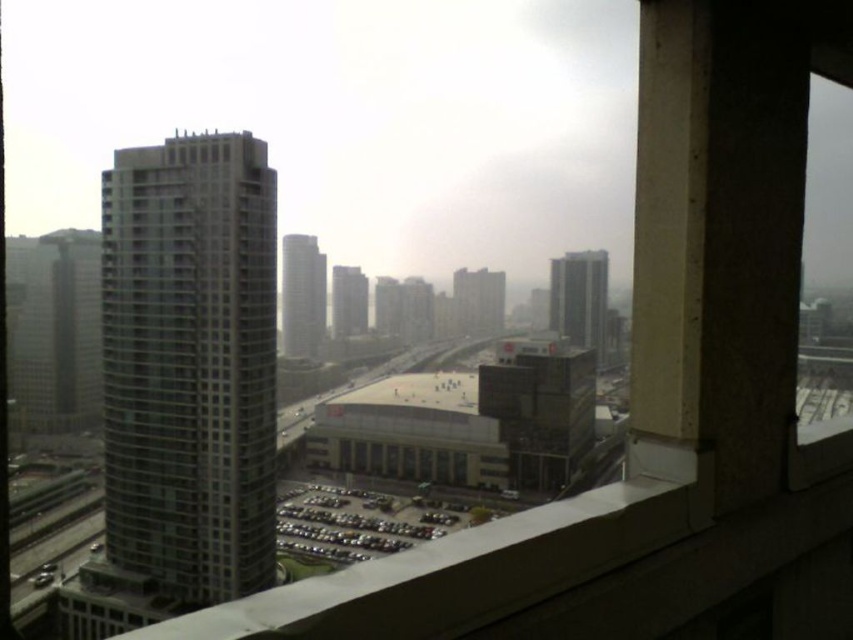
Can you confirm if glassy gray tower at left is positioned to the right of gray glass skyscraper at center?

Indeed, glassy gray tower at left is positioned on the right side of gray glass skyscraper at center.

Does glassy gray tower at left appear under gray glass skyscraper at center?

Yes, glassy gray tower at left is below gray glass skyscraper at center.

The image size is (853, 640). Identify the location of glassy gray tower at left. (190, 364).

Where is `glassy gray tower at left`? Image resolution: width=853 pixels, height=640 pixels. glassy gray tower at left is located at coordinates (190, 364).

Consider the image. Is glassy reflective building at center closer to the viewer compared to glassy reflective skyscraper at center?

Yes, glassy reflective building at center is in front of glassy reflective skyscraper at center.

You are a GUI agent. You are given a task and a screenshot of the screen. Output one action in this format:
    pyautogui.click(x=<x>, y=<y>)
    Task: Click on the glassy reflective building at center
    This screenshot has height=640, width=853.
    Given the screenshot: What is the action you would take?
    pyautogui.click(x=579, y=298)

What are the coordinates of `glassy reflective building at center` in the screenshot? It's located at (579, 298).

Can you confirm if glassy gray tower at left is thinner than matte glass building at center?

Incorrect, glassy gray tower at left's width is not less than matte glass building at center's.

Which of these two, glassy gray tower at left or matte glass building at center, stands shorter?

Standing shorter between the two is matte glass building at center.

Between point (165, 365) and point (476, 333), which one is positioned behind?

The point (476, 333) is behind.

I want to click on glassy gray tower at left, so click(190, 364).